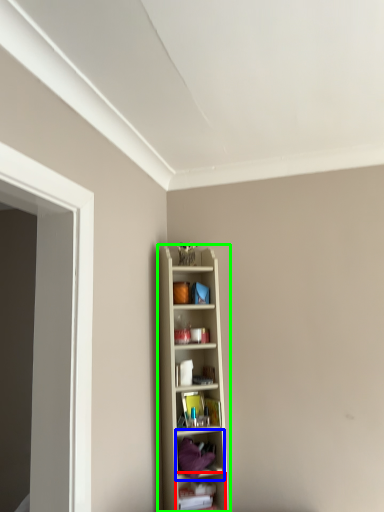
Question: Which is nearer to the shelf (highlighted by a red box)? shelf (highlighted by a blue box) or shelf (highlighted by a green box).

Choices:
 (A) shelf
 (B) shelf

Answer: (A)